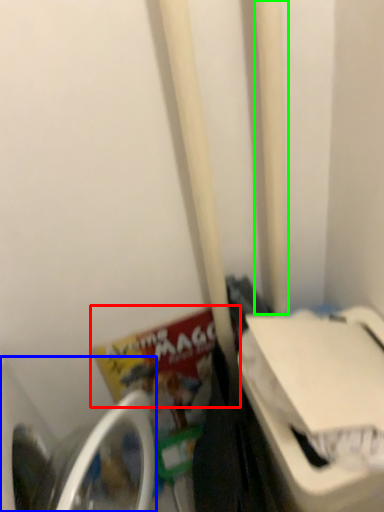
Question: Estimate the real-world distances between objects in this image. Which object is closer to book (highlighted by a red box), washing machine (highlighted by a blue box) or pole (highlighted by a green box)?

Choices:
 (A) washing machine
 (B) pole

Answer: (A)